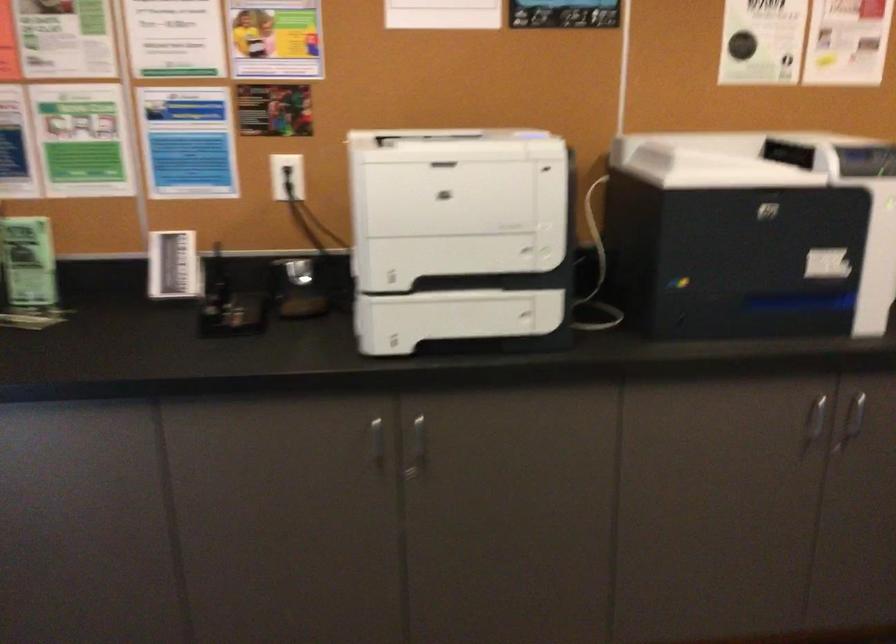
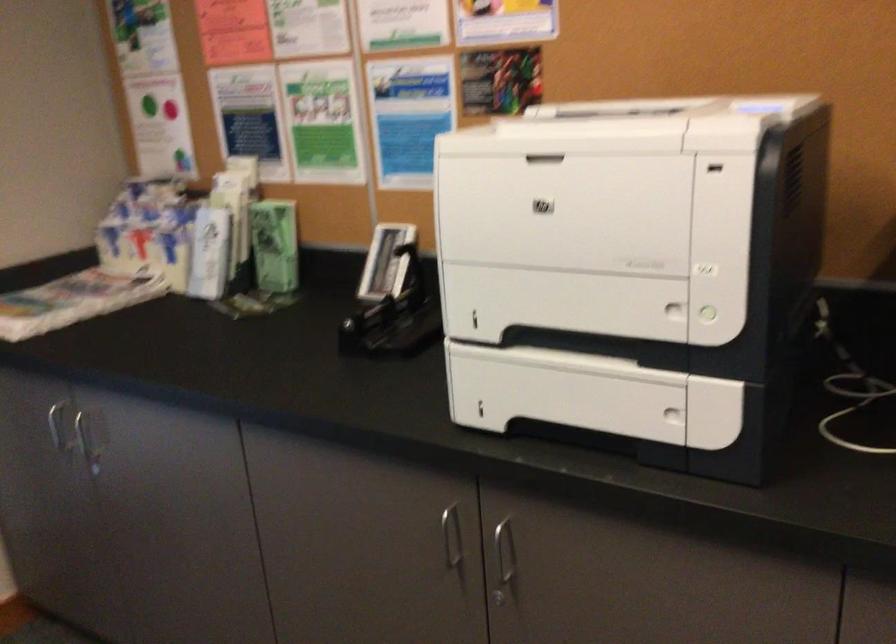
In the second image, find the point that corresponds to (373,440) in the first image.

(452, 538)